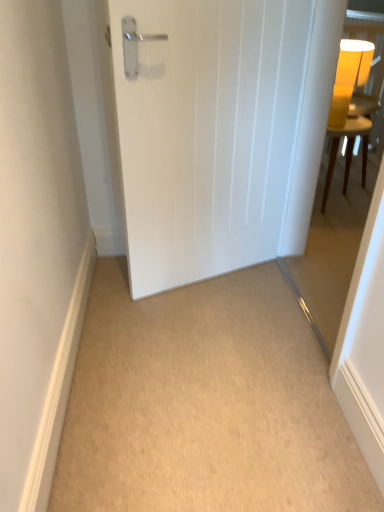
At what (x,y) coordinates should I click in order to perform the action: click on yellow matte table lamp at upper right. Please return your answer as a coordinate pair (x, y). Image resolution: width=384 pixels, height=512 pixels. Looking at the image, I should click on (349, 77).

Describe the element at coordinates (335, 234) in the screenshot. This screenshot has width=384, height=512. I see `transparent glass door at right` at that location.

Identify the location of yellow wood table at upper right. This screenshot has width=384, height=512. (347, 150).

Does point (300, 282) lie behind point (85, 439)?

Yes, point (300, 282) is behind point (85, 439).

Consider the image. Could you tell me if transparent glass door at right is facing beige carpet at center?

Yes, transparent glass door at right is aimed at beige carpet at center.

Locate an element on the screen. glass door above the beige carpet at center (from the image's perspective) is located at coordinates (335, 234).

From the picture: Can you confirm if transparent glass door at right is shorter than beige carpet at center?

No.

Can you confirm if transparent glass door at right is thinner than yellow matte table lamp at upper right?

Yes, transparent glass door at right is thinner than yellow matte table lamp at upper right.

Can you confirm if transparent glass door at right is positioned to the right of yellow matte table lamp at upper right?

In fact, transparent glass door at right is to the left of yellow matte table lamp at upper right.

How different are the orientations of transparent glass door at right and yellow matte table lamp at upper right in degrees?

180 degrees separate the facing orientations of transparent glass door at right and yellow matte table lamp at upper right.

Is transparent glass door at right far from yellow matte table lamp at upper right?

transparent glass door at right is near yellow matte table lamp at upper right, not far away.

Who is shorter, white matte door at center or yellow wood table at upper right?

With less height is yellow wood table at upper right.

Does white matte door at center turn towards yellow wood table at upper right?

No, white matte door at center does not turn towards yellow wood table at upper right.

Is the depth of white matte door at center less than that of yellow wood table at upper right?

That is True.

Where is `furniture that is on the right side of beige carpet at center`? The image size is (384, 512). furniture that is on the right side of beige carpet at center is located at coordinates (347, 150).

Does point (107, 449) lie in front of point (346, 148)?

That is True.

Is beige carpet at center not near yellow wood table at upper right?

beige carpet at center is positioned a significant distance from yellow wood table at upper right.

In terms of height, does yellow matte table lamp at upper right look taller or shorter compared to yellow wood table at upper right?

Considering their sizes, yellow matte table lamp at upper right has less height than yellow wood table at upper right.

Is point (339, 100) closer to camera compared to point (330, 149)?

Yes, it is in front of point (330, 149).

Considering the relative sizes of yellow matte table lamp at upper right and yellow wood table at upper right in the image provided, is yellow matte table lamp at upper right wider than yellow wood table at upper right?

No, yellow matte table lamp at upper right is not wider than yellow wood table at upper right.

Which object is positioned more to the right, yellow matte table lamp at upper right or yellow wood table at upper right?

yellow wood table at upper right is more to the right.

Which object is wider, beige carpet at center or white matte door at center?

beige carpet at center is wider.

Is point (152, 350) closer or farther from the camera than point (146, 114)?

Point (152, 350) appears to be farther away from the viewer than point (146, 114).

I want to click on corridor that appears below the white matte door at center (from the image's perspective), so click(205, 404).

Does beige carpet at center have a lesser height compared to white matte door at center?

Yes, beige carpet at center is shorter than white matte door at center.

Based on the photo, what's the angular difference between white matte door at center and transparent glass door at right's facing directions?

116 degrees.

Is white matte door at center placed right next to transparent glass door at right?

No.

Is white matte door at center smaller than transparent glass door at right?

Indeed, white matte door at center has a smaller size compared to transparent glass door at right.

Who is taller, white matte door at center or transparent glass door at right?

white matte door at center.

At what (x,y) coordinates should I click in order to perform the action: click on glass door that is above the beige carpet at center (from the image's perspective). Please return your answer as a coordinate pair (x, y). This screenshot has width=384, height=512. Looking at the image, I should click on (335, 234).

Identify the location of table lamp positioned vertically above the transparent glass door at right (from a real-world perspective). (349, 77).

Considering their positions, is beige carpet at center positioned closer to yellow wood table at upper right than transparent glass door at right?

transparent glass door at right is positioned closer to the anchor yellow wood table at upper right.

Estimate the real-world distances between objects in this image. Which object is closer to yellow wood table at upper right, white matte door at center or beige carpet at center?

Based on the image, white matte door at center appears to be nearer to yellow wood table at upper right.

Based on the photo, looking at the image, which one is located further to yellow wood table at upper right, white matte door at center or transparent glass door at right?

white matte door at center is further to yellow wood table at upper right.

When comparing their distances from beige carpet at center, does transparent glass door at right or yellow matte table lamp at upper right seem closer?

transparent glass door at right is closer to beige carpet at center.

Based on their spatial positions, is white matte door at center or yellow wood table at upper right closer to beige carpet at center?

white matte door at center.

Estimate the real-world distances between objects in this image. Which object is further from yellow wood table at upper right, transparent glass door at right or beige carpet at center?

Based on the image, beige carpet at center appears to be further to yellow wood table at upper right.

From the image, which object appears to be nearer to beige carpet at center, white matte door at center or yellow matte table lamp at upper right?

white matte door at center is closer to beige carpet at center.

Estimate the real-world distances between objects in this image. Which object is further from yellow matte table lamp at upper right, transparent glass door at right or white matte door at center?

Among the two, white matte door at center is located further to yellow matte table lamp at upper right.

This screenshot has height=512, width=384. Find the location of `corridor positioned between transparent glass door at right and yellow matte table lamp at upper right from near to far`. corridor positioned between transparent glass door at right and yellow matte table lamp at upper right from near to far is located at coordinates (205, 404).

Identify the location of table lamp located between beige carpet at center and yellow wood table at upper right in the depth direction. (349, 77).

Locate an element on the screen. corridor located between transparent glass door at right and yellow wood table at upper right in the depth direction is located at coordinates (205, 404).

This screenshot has width=384, height=512. Identify the location of door located between transparent glass door at right and yellow matte table lamp at upper right in the depth direction. (207, 133).